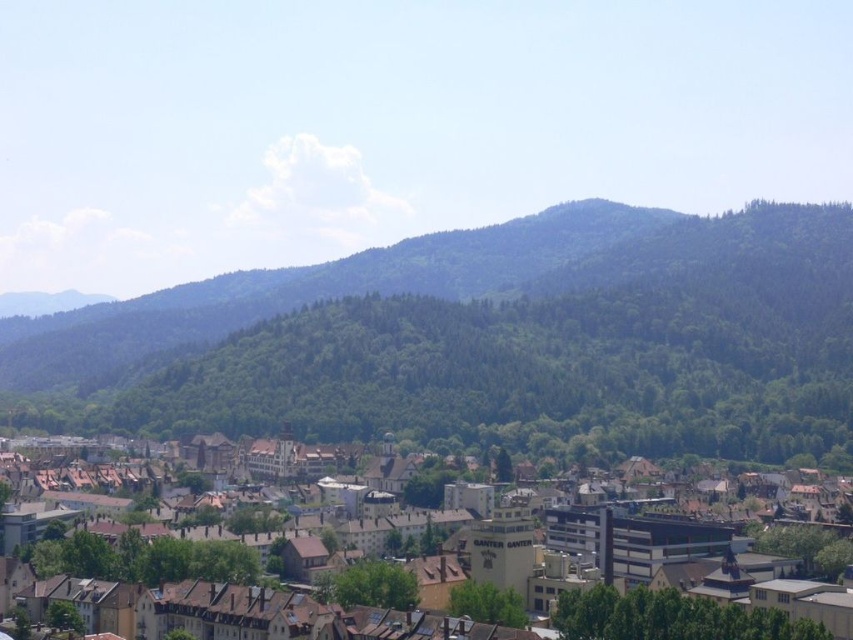
Identify the location of green forested mountain at center. (489, 340).

Does point (602, 288) lie in front of point (587, 628)?

No, (602, 288) is behind (587, 628).

This screenshot has height=640, width=853. What do you see at coordinates (489, 340) in the screenshot?
I see `green forested mountain at center` at bounding box center [489, 340].

What are the coordinates of `green forested mountain at center` in the screenshot? It's located at (489, 340).